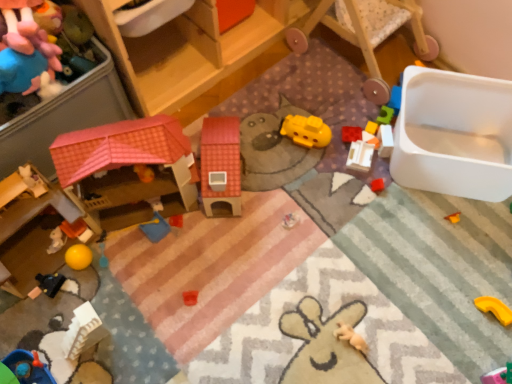
Where is `unoccupied space behind light brown plush toy at lower right, which appears as the 6th toy when viewed from the left`? The width and height of the screenshot is (512, 384). unoccupied space behind light brown plush toy at lower right, which appears as the 6th toy when viewed from the left is located at coordinates (340, 278).